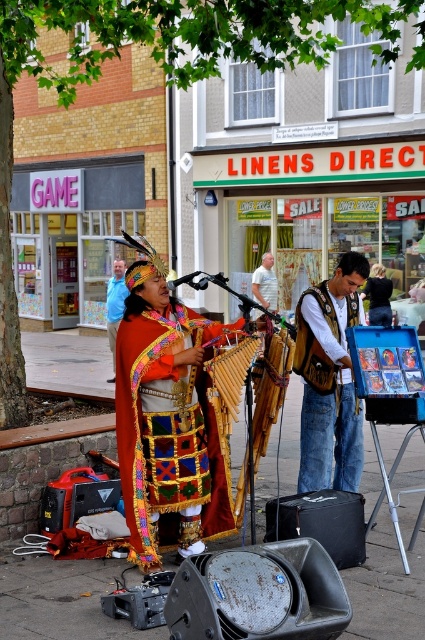
You are a photographer positioned at the origin point of the image. You want to capture a photo of the matte multicolored poncho at center. Which direction should you move your camera to focus on it?

The matte multicolored poncho at center is located at coordinates point (x=167, y=422). Since the origin is at the bottom left corner, you should move your camera to the right and upwards to focus on it.

You are a photographer capturing the performer in the center. You need to focus on the blue fabric shirt at center and the matte multicolored poncho at center. Which one is positioned lower on the performer?

The matte multicolored poncho at center is located below the blue fabric shirt at center, so the matte multicolored poncho at center is positioned lower on the performer.